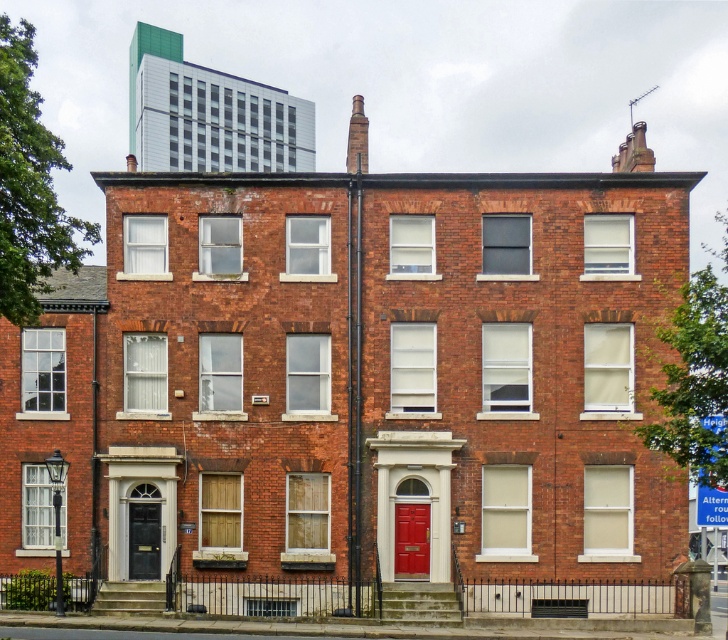
Question: Does matte red door at center lie behind matte black door at left?

Choices:
 (A) yes
 (B) no

Answer: (B)

Question: Which point is closer to the camera?

Choices:
 (A) matte red door at center
 (B) matte black door at left

Answer: (A)

Question: Where is matte red door at center located in relation to matte black door at left in the image?

Choices:
 (A) right
 (B) left

Answer: (A)

Question: Is matte red door at center bigger than matte black door at left?

Choices:
 (A) no
 (B) yes

Answer: (A)